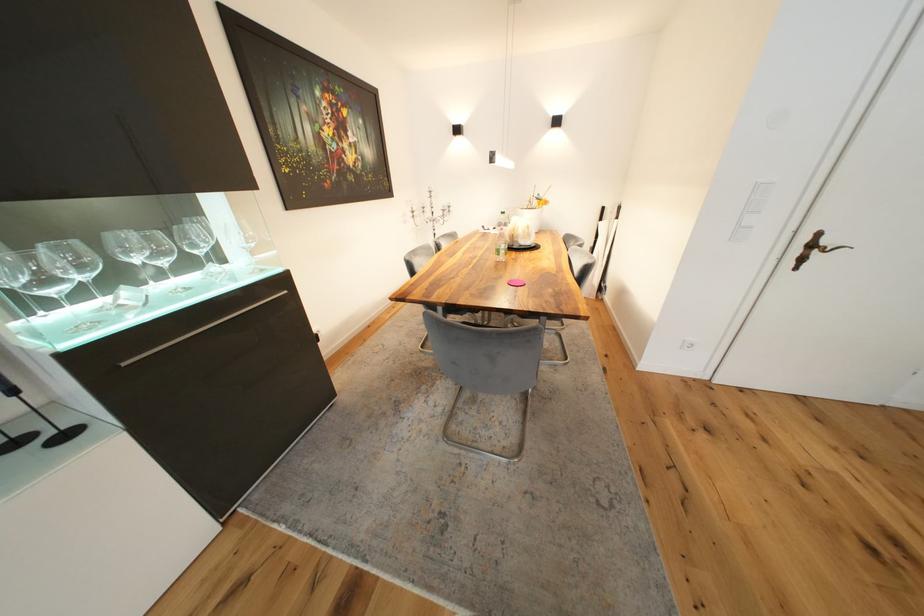
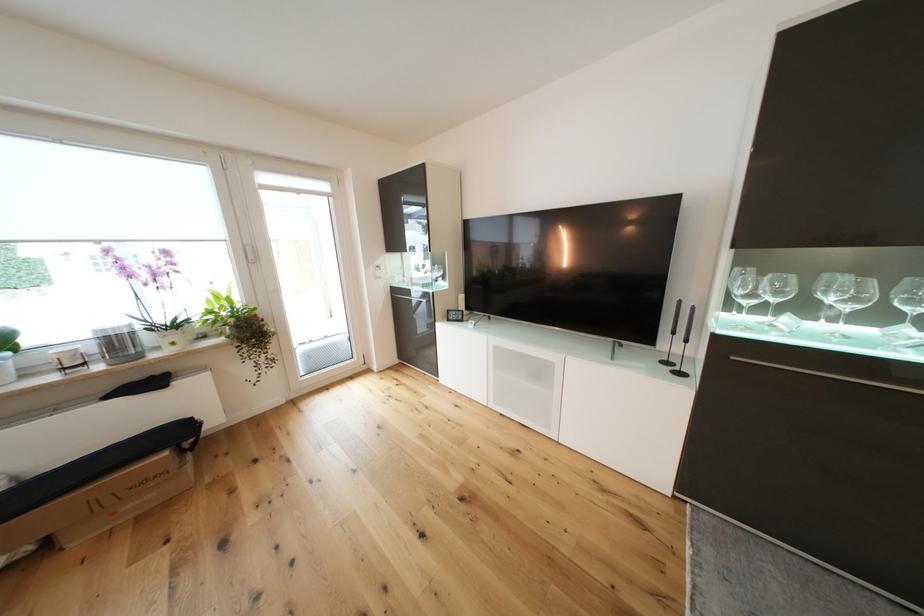
Find the pixel in the second image that matches (202,254) in the first image.

(913, 310)